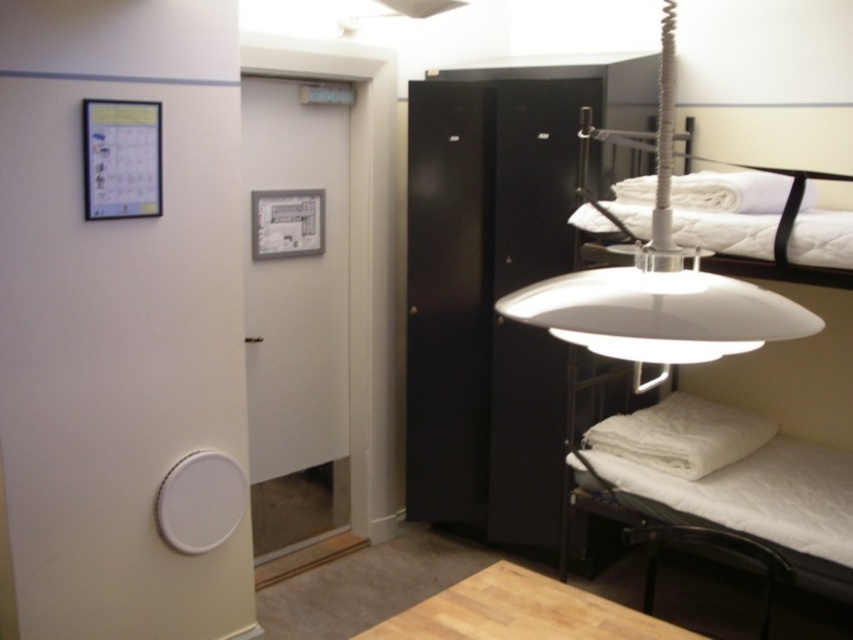
Which of these two, white matte lampshade at upper right or white quilted bed at upper right, stands taller?

white matte lampshade at upper right

Who is higher up, white matte lampshade at upper right or white quilted bed at upper right?

white quilted bed at upper right is higher up.

Which is in front, point (541, 282) or point (737, 230)?

Point (737, 230) is in front.

Find the location of `white matte lampshade at upper right`. white matte lampshade at upper right is located at coordinates (659, 285).

Does white matte bed at lower right have a lesser width compared to white matte lampshade at upper right?

Incorrect, white matte bed at lower right's width is not less than white matte lampshade at upper right's.

Find the location of a particular element. This screenshot has width=853, height=640. white matte bed at lower right is located at coordinates (730, 481).

At what (x,y) coordinates should I click in order to perform the action: click on white matte bed at lower right. Please return your answer as a coordinate pair (x, y). The height and width of the screenshot is (640, 853). Looking at the image, I should click on (730, 481).

Does white matte bed at lower right lie in front of white quilted bed at upper right?

No, it is behind white quilted bed at upper right.

Who is positioned more to the left, white matte bed at lower right or white quilted bed at upper right?

white quilted bed at upper right is more to the left.

Between point (740, 493) and point (817, 273), which one is positioned in front?

Point (817, 273)

Locate an element on the screen. This screenshot has width=853, height=640. white matte bed at lower right is located at coordinates (730, 481).